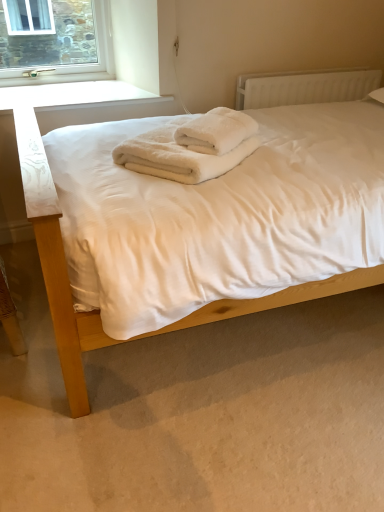
Question: From the image's perspective, is white plastic radiator at upper right below white fluffy towels at center?

Choices:
 (A) no
 (B) yes

Answer: (A)

Question: Does white plastic radiator at upper right have a greater height compared to white fluffy towels at center?

Choices:
 (A) no
 (B) yes

Answer: (B)

Question: Does white plastic radiator at upper right lie behind white fluffy towels at center?

Choices:
 (A) yes
 (B) no

Answer: (A)

Question: Can you confirm if white plastic radiator at upper right is positioned to the left of white fluffy towels at center?

Choices:
 (A) yes
 (B) no

Answer: (B)

Question: Is white plastic radiator at upper right in front of white fluffy towels at center?

Choices:
 (A) yes
 (B) no

Answer: (B)

Question: In the image, is white fluffy towels at center positioned in front of or behind white soft bed at center?

Choices:
 (A) front
 (B) behind

Answer: (B)

Question: Is point (230, 121) closer or farther from the camera than point (49, 89)?

Choices:
 (A) closer
 (B) farther

Answer: (A)

Question: Looking at the image, does white fluffy towels at center seem bigger or smaller compared to white soft bed at center?

Choices:
 (A) small
 (B) big

Answer: (A)

Question: From the image's perspective, is white fluffy towels at center above or below white soft bed at center?

Choices:
 (A) below
 (B) above

Answer: (B)

Question: Is white fluffy towels at center to the left or to the right of white fluffy towels at center in the image?

Choices:
 (A) left
 (B) right

Answer: (A)

Question: Considering the positions of white fluffy towels at center and white fluffy towels at center in the image, is white fluffy towels at center wider or thinner than white fluffy towels at center?

Choices:
 (A) thin
 (B) wide

Answer: (B)

Question: In terms of height, does white fluffy towels at center look taller or shorter compared to white fluffy towels at center?

Choices:
 (A) short
 (B) tall

Answer: (B)

Question: From a real-world perspective, is white fluffy towels at center physically located above or below white fluffy towels at center?

Choices:
 (A) below
 (B) above

Answer: (A)

Question: In terms of height, does white fluffy towels at center look taller or shorter compared to white plastic radiator at upper right?

Choices:
 (A) short
 (B) tall

Answer: (A)

Question: Is point (193, 128) closer or farther from the camera than point (377, 72)?

Choices:
 (A) closer
 (B) farther

Answer: (A)